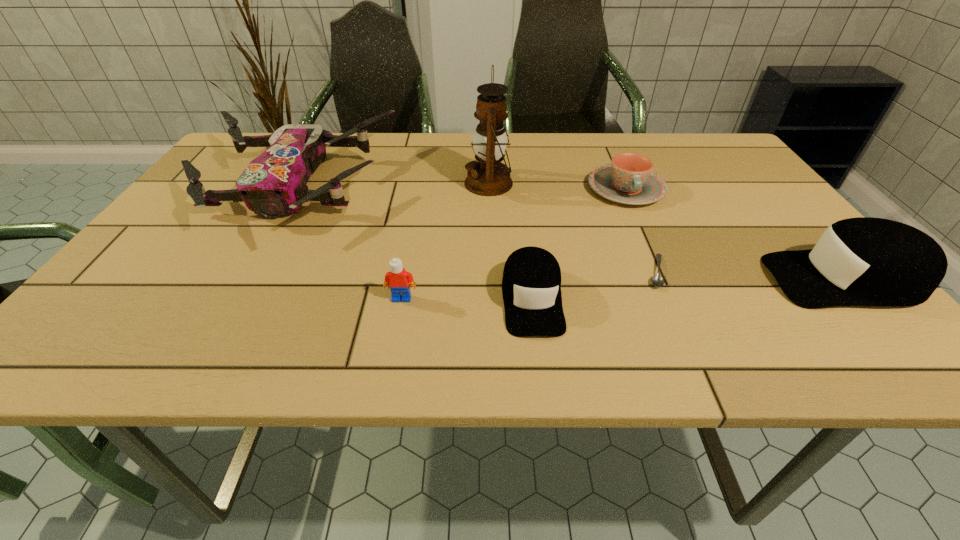
Locate an element on the screen. Image resolution: width=960 pixels, height=540 pixels. free space between the chinaware and the soupspoon is located at coordinates (641, 230).

This screenshot has width=960, height=540. Identify the location of free space that is in between the right cap and the chinaware. (734, 234).

Where is `free space that is in between the chinaware and the second object from left to right`? free space that is in between the chinaware and the second object from left to right is located at coordinates (514, 244).

This screenshot has height=540, width=960. I want to click on free area in between the chinaware and the lantern, so 557,186.

In order to click on free space between the taller cap and the chinaware in this screenshot , I will do `click(734, 234)`.

Find the location of a particular element. The height and width of the screenshot is (540, 960). free space between the chinaware and the lantern is located at coordinates click(x=557, y=186).

This screenshot has height=540, width=960. In order to click on empty space that is in between the right cap and the leftmost object in this screenshot , I will do (568, 233).

This screenshot has height=540, width=960. I want to click on free space between the leftmost object and the lantern, so click(391, 185).

The image size is (960, 540). In order to click on free space between the leftmost object and the shorter cap in this screenshot , I will do `click(412, 242)`.

You are a GUI agent. You are given a task and a screenshot of the screen. Output one action in this format:
    pyautogui.click(x=<x>, y=<y>)
    Task: Click on the object that is the closest to the tallest object
    
    Given the screenshot: What is the action you would take?
    pyautogui.click(x=629, y=179)